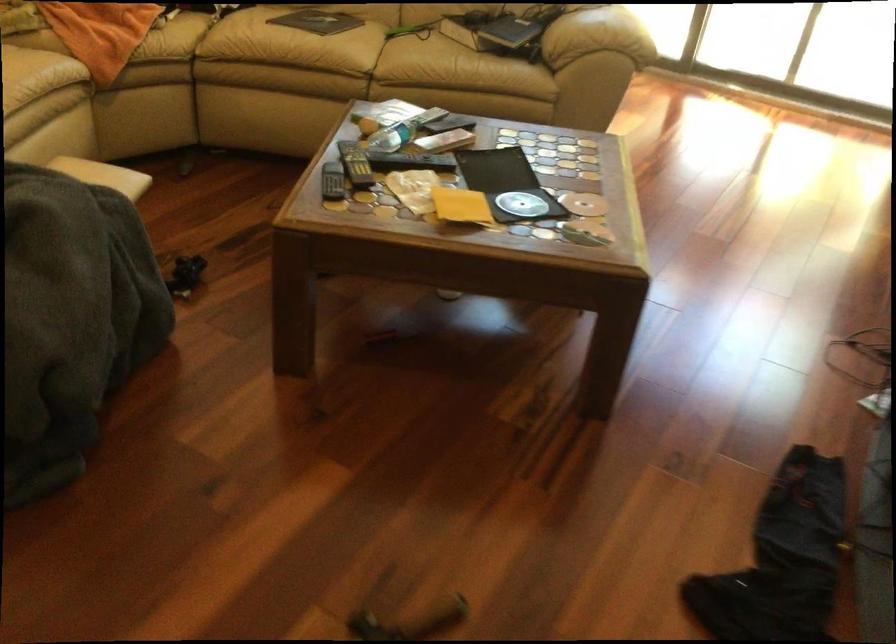
What do you see at coordinates (392, 136) in the screenshot? I see `the plastic water bottle` at bounding box center [392, 136].